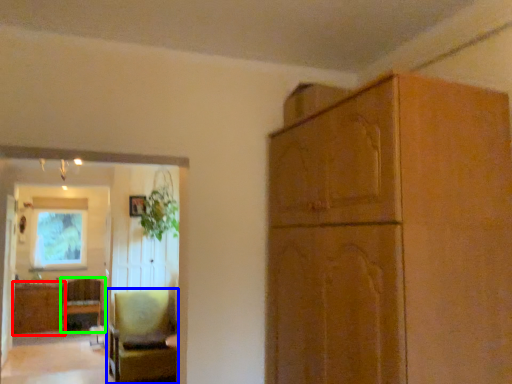
Question: Based on their relative distances, which object is nearer to cabinetry (highlighted by a red box)? Choose from chair (highlighted by a blue box) and chair (highlighted by a green box).

Choices:
 (A) chair
 (B) chair

Answer: (B)